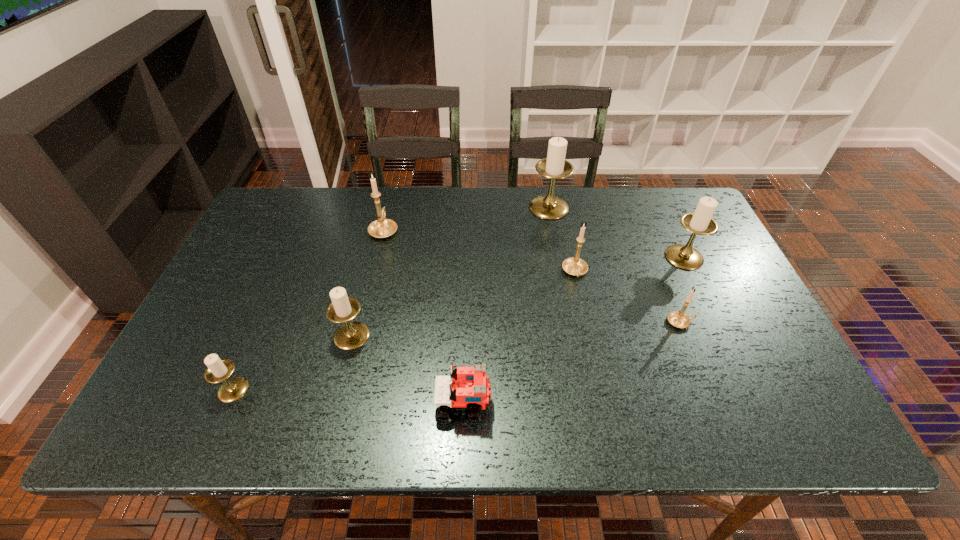
The width and height of the screenshot is (960, 540). Identify the location of the nearest gold candle holder. (678, 319).

The height and width of the screenshot is (540, 960). I want to click on the smallest gold candle holder, so 678,319.

Locate an element on the screen. The image size is (960, 540). the nearest white candle holder is located at coordinates (218, 370).

Where is `the leftmost object`? The height and width of the screenshot is (540, 960). the leftmost object is located at coordinates (218, 370).

Find the location of a particular element. the fourth object from left to right is located at coordinates (470, 388).

This screenshot has width=960, height=540. Find the location of `Lego`. Lego is located at coordinates (470, 388).

This screenshot has height=540, width=960. What are the coordinates of `vacant space located on the front of the biggest white candle holder` in the screenshot? It's located at (566, 308).

This screenshot has width=960, height=540. I want to click on free space located 0.130m on the handle side of the farthest gold candle holder, so click(393, 194).

Where is `free space located 0.150m on the handle side of the farthest gold candle holder`? free space located 0.150m on the handle side of the farthest gold candle holder is located at coordinates (394, 191).

This screenshot has height=540, width=960. Identify the location of vacant area situated on the handle side of the farthest gold candle holder. (394, 189).